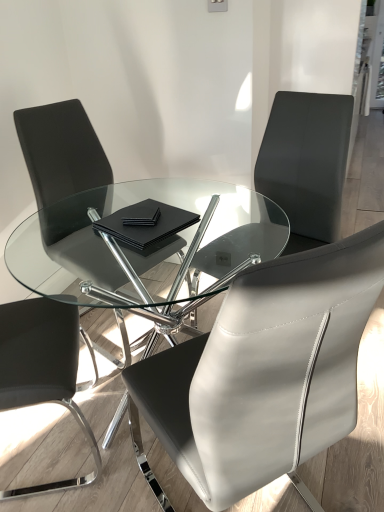
How much space does matte black chair at left, arranged as the 3th chair when viewed from the right, occupy horizontally?

The width of matte black chair at left, arranged as the 3th chair when viewed from the right, is 22.47 inches.

This screenshot has width=384, height=512. In order to click on black matte notebook at center in this screenshot , I will do `click(146, 223)`.

What do you see at coordinates (306, 164) in the screenshot?
I see `black leather chair at upper right, the fourth chair viewed from the left` at bounding box center [306, 164].

The height and width of the screenshot is (512, 384). I want to click on transparent glass table at center, so click(x=146, y=249).

Locate an element on the screen. The width and height of the screenshot is (384, 512). matte black chair at left, arranged as the 3th chair when viewed from the right is located at coordinates (61, 151).

Is black leather chair at upper right, the fourth chair viewed from the left, next to matte black chair at left, arranged as the 3th chair when viewed from the right?

No, black leather chair at upper right, the fourth chair viewed from the left, is not in contact with matte black chair at left, arranged as the 3th chair when viewed from the right.

Does black leather chair at upper right, marked as the 1th chair in a right-to-left arrangement, have a greater width compared to matte black chair at left, arranged as the 3th chair when viewed from the right?

Indeed, black leather chair at upper right, marked as the 1th chair in a right-to-left arrangement, has a greater width compared to matte black chair at left, arranged as the 3th chair when viewed from the right.

Does black leather chair at upper right, marked as the 1th chair in a right-to-left arrangement, have a lesser height compared to matte black chair at left, arranged as the 3th chair when viewed from the right?

Correct, black leather chair at upper right, marked as the 1th chair in a right-to-left arrangement, is not as tall as matte black chair at left, arranged as the 3th chair when viewed from the right.

Based on the photo, is matte black chair at left, which ranks as the second chair in left-to-right order, oriented away from black leather chair at center, placed as the 2th chair when sorted from right to left?

No.

How many degrees apart are the facing directions of matte black chair at left, which ranks as the second chair in left-to-right order, and black leather chair at center, arranged as the 3th chair when viewed from the left?

matte black chair at left, which ranks as the second chair in left-to-right order, and black leather chair at center, arranged as the 3th chair when viewed from the left, are facing 159 degrees away from each other.

Is point (46, 130) behind point (257, 449)?

Yes, it is behind point (257, 449).

From the image's perspective, which is above, matte black chair at left, arranged as the 3th chair when viewed from the right, or black leather chair at center, arranged as the 3th chair when viewed from the left?

From the image's view, matte black chair at left, arranged as the 3th chair when viewed from the right, is above.

From a real-world perspective, is matte black chair at left, arranged as the 3th chair when viewed from the right, on black matte notebook at center?

No, from a real-world perspective, matte black chair at left, arranged as the 3th chair when viewed from the right, is not over black matte notebook at center

Which is correct: matte black chair at left, arranged as the 3th chair when viewed from the right, is inside black matte notebook at center, or outside of it?

matte black chair at left, arranged as the 3th chair when viewed from the right, is spatially situated outside black matte notebook at center.

Could you tell me if matte black chair at left, which ranks as the second chair in left-to-right order, is facing black matte notebook at center?

Yes, matte black chair at left, which ranks as the second chair in left-to-right order, is aimed at black matte notebook at center.

How far apart are matte black chair at left, which ranks as the second chair in left-to-right order, and black matte notebook at center?

matte black chair at left, which ranks as the second chair in left-to-right order, and black matte notebook at center are 22.28 inches apart.

Does black leather chair at center, arranged as the 3th chair when viewed from the left, have a lesser width compared to black matte notebook at center?

No.

How much distance is there between black leather chair at center, arranged as the 3th chair when viewed from the left, and black matte notebook at center?

22.35 inches.

Which of these two, black leather chair at center, placed as the 2th chair when sorted from right to left, or black matte notebook at center, is smaller?

black matte notebook at center is smaller.

Considering the positions of objects black leather chair at center, arranged as the 3th chair when viewed from the left, and black matte notebook at center in the image provided, who is in front, black leather chair at center, arranged as the 3th chair when viewed from the left, or black matte notebook at center?

black leather chair at center, arranged as the 3th chair when viewed from the left.

Is transparent glass table at center to the left or to the right of black leather chair at upper right, the fourth chair viewed from the left, in the image?

From the image, it's evident that transparent glass table at center is to the left of black leather chair at upper right, the fourth chair viewed from the left.

Considering the sizes of objects transparent glass table at center and black leather chair at upper right, marked as the 1th chair in a right-to-left arrangement, in the image provided, who is bigger, transparent glass table at center or black leather chair at upper right, marked as the 1th chair in a right-to-left arrangement,?

With larger size is transparent glass table at center.

From the image's perspective, is transparent glass table at center above black leather chair at upper right, the fourth chair viewed from the left?

Actually, transparent glass table at center appears below black leather chair at upper right, the fourth chair viewed from the left, in the image.

From a real-world perspective, is transparent glass table at center positioned under black leather chair at upper right, the fourth chair viewed from the left, based on gravity?

Yes, from a real-world perspective, transparent glass table at center is below black leather chair at upper right, the fourth chair viewed from the left.

From a real-world perspective, between matte black chair at left, arranged as the 3th chair when viewed from the right, and black leather chair at left, the fourth chair positioned from the right, who is vertically higher?

matte black chair at left, arranged as the 3th chair when viewed from the right.

Is matte black chair at left, arranged as the 3th chair when viewed from the right, at the right side of black leather chair at left, the 1th chair positioned from the left?

Correct, you'll find matte black chair at left, arranged as the 3th chair when viewed from the right, to the right of black leather chair at left, the 1th chair positioned from the left.

I want to click on the 2nd chair behind when counting from the black leather chair at left, the fourth chair positioned from the right, so click(61, 151).

From the image's perspective, is matte black chair at left, arranged as the 3th chair when viewed from the right, over black leather chair at left, the 1th chair positioned from the left?

Yes, from the image's perspective, matte black chair at left, arranged as the 3th chair when viewed from the right, is on top of black leather chair at left, the 1th chair positioned from the left.

Locate an element on the screen. chair that is the 2nd one when counting downward from the transparent glass table at center (from the image's perspective) is located at coordinates pyautogui.click(x=266, y=370).

Based on the photo, considering the sizes of objects transparent glass table at center and black leather chair at center, arranged as the 3th chair when viewed from the left, in the image provided, who is shorter, transparent glass table at center or black leather chair at center, arranged as the 3th chair when viewed from the left,?

transparent glass table at center is shorter.

From a real-world perspective, relative to black leather chair at center, arranged as the 3th chair when viewed from the left, is transparent glass table at center vertically above or below?

From a real-world perspective, transparent glass table at center is physically below black leather chair at center, arranged as the 3th chair when viewed from the left.

Is transparent glass table at center positioned far away from black leather chair at center, placed as the 2th chair when sorted from right to left?

They are positioned close to each other.

I want to click on chair that is the 2nd one when counting rightward from the matte black chair at left, which ranks as the second chair in left-to-right order, so click(x=306, y=164).

The width and height of the screenshot is (384, 512). What are the coordinates of `the 3rd chair behind the black leather chair at center, arranged as the 3th chair when viewed from the left, starting your count from the anchor` in the screenshot? It's located at (61, 151).

Which object lies further to the anchor point black leather chair at left, the fourth chair positioned from the right, black leather chair at center, arranged as the 3th chair when viewed from the left, or black matte notebook at center?

Among the two, black leather chair at center, arranged as the 3th chair when viewed from the left, is located further to black leather chair at left, the fourth chair positioned from the right.

Based on their spatial positions, is transparent glass table at center or matte black chair at left, which ranks as the second chair in left-to-right order, closer to black matte notebook at center?

transparent glass table at center.

Estimate the real-world distances between objects in this image. Which object is closer to matte black chair at left, which ranks as the second chair in left-to-right order, black matte notebook at center or black leather chair at left, the fourth chair positioned from the right?

black matte notebook at center is closer to matte black chair at left, which ranks as the second chair in left-to-right order.

Considering their positions, is matte black chair at left, arranged as the 3th chair when viewed from the right, positioned further to black leather chair at upper right, marked as the 1th chair in a right-to-left arrangement, than black leather chair at left, the fourth chair positioned from the right?

Among the two, black leather chair at left, the fourth chair positioned from the right, is located further to black leather chair at upper right, marked as the 1th chair in a right-to-left arrangement.

From the image, which object appears to be farther from matte black chair at left, which ranks as the second chair in left-to-right order, black leather chair at upper right, the fourth chair viewed from the left, or black leather chair at center, arranged as the 3th chair when viewed from the left?

black leather chair at center, arranged as the 3th chair when viewed from the left, is further to matte black chair at left, which ranks as the second chair in left-to-right order.

Looking at the image, which one is located further to matte black chair at left, which ranks as the second chair in left-to-right order, black matte notebook at center or transparent glass table at center?

black matte notebook at center.

Estimate the real-world distances between objects in this image. Which object is further from black matte notebook at center, matte black chair at left, arranged as the 3th chair when viewed from the right, or black leather chair at upper right, marked as the 1th chair in a right-to-left arrangement?

black leather chair at upper right, marked as the 1th chair in a right-to-left arrangement, is positioned further to the anchor black matte notebook at center.

Considering their positions, is black matte notebook at center positioned further to black leather chair at upper right, marked as the 1th chair in a right-to-left arrangement, than black leather chair at left, the 1th chair positioned from the left?

black leather chair at left, the 1th chair positioned from the left, is further to black leather chair at upper right, marked as the 1th chair in a right-to-left arrangement.

Locate an element on the screen. coffee table between black leather chair at center, placed as the 2th chair when sorted from right to left, and black leather chair at upper right, the fourth chair viewed from the left, along the z-axis is located at coordinates (146, 249).

Identify the location of coffee table located between black leather chair at left, the fourth chair positioned from the right, and black leather chair at center, arranged as the 3th chair when viewed from the left, in the left-right direction. (146, 249).

Locate an element on the screen. This screenshot has width=384, height=512. coffee table positioned between black leather chair at left, the 1th chair positioned from the left, and matte black chair at left, arranged as the 3th chair when viewed from the right, from near to far is located at coordinates [146, 249].

This screenshot has height=512, width=384. Find the location of `coffee table between black leather chair at center, placed as the 2th chair when sorted from right to left, and black matte notebook at center, along the z-axis`. coffee table between black leather chair at center, placed as the 2th chair when sorted from right to left, and black matte notebook at center, along the z-axis is located at coordinates (146, 249).